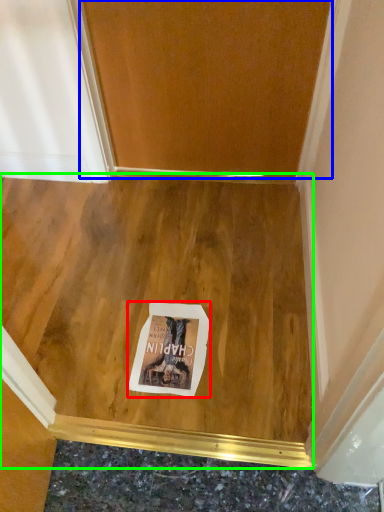
Question: Based on their relative distances, which object is nearer to postcard (highlighted by a red box)? Choose from door (highlighted by a blue box) and plywood (highlighted by a green box).

Choices:
 (A) door
 (B) plywood

Answer: (B)